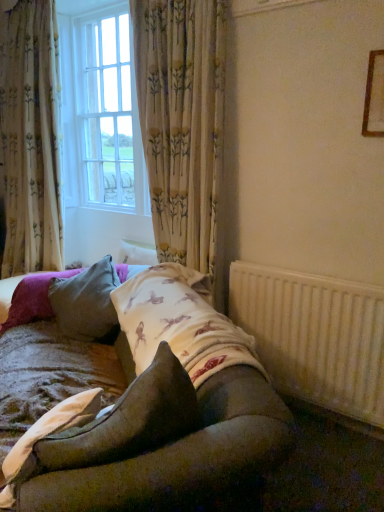
Question: From a real-world perspective, is white textured radiator at lower right positioned under wooden frame at upper right based on gravity?

Choices:
 (A) no
 (B) yes

Answer: (B)

Question: Can you confirm if white textured radiator at lower right is positioned to the left of wooden frame at upper right?

Choices:
 (A) yes
 (B) no

Answer: (A)

Question: Is white textured radiator at lower right beside wooden frame at upper right?

Choices:
 (A) yes
 (B) no

Answer: (B)

Question: Could you tell me if white textured radiator at lower right is turned towards wooden frame at upper right?

Choices:
 (A) no
 (B) yes

Answer: (A)

Question: Is the position of white textured radiator at lower right more distant than that of wooden frame at upper right?

Choices:
 (A) yes
 (B) no

Answer: (A)

Question: Looking at the image, does velvet brown pillow at center, the 2th pillow viewed from the back, seem bigger or smaller compared to white glass window at upper left?

Choices:
 (A) small
 (B) big

Answer: (A)

Question: Looking at their shapes, would you say velvet brown pillow at center, the 2th pillow viewed from the back, is wider or thinner than white glass window at upper left?

Choices:
 (A) wide
 (B) thin

Answer: (B)

Question: From the image's perspective, is velvet brown pillow at center, the 2th pillow viewed from the back, positioned above or below white glass window at upper left?

Choices:
 (A) above
 (B) below

Answer: (B)

Question: Do you think velvet brown pillow at center, arranged as the first pillow when viewed from the front, is within white glass window at upper left, or outside of it?

Choices:
 (A) inside
 (B) outside

Answer: (B)

Question: From the image's perspective, relative to velvet brown pillow at center, the 2th pillow viewed from the back, is floral fabric curtain at center, which is the second curtain in left-to-right order, above or below?

Choices:
 (A) above
 (B) below

Answer: (A)

Question: Is floral fabric curtain at center, which is the second curtain in left-to-right order, inside the boundaries of velvet brown pillow at center, arranged as the first pillow when viewed from the front, or outside?

Choices:
 (A) inside
 (B) outside

Answer: (B)

Question: From a real-world perspective, relative to velvet brown pillow at center, the 2th pillow viewed from the back, is floral fabric curtain at center, which is the second curtain in left-to-right order, vertically above or below?

Choices:
 (A) below
 (B) above

Answer: (B)

Question: Considering the positions of floral fabric curtain at center, arranged as the first curtain when viewed from the right, and velvet brown pillow at center, the 2th pillow viewed from the back, in the image, is floral fabric curtain at center, arranged as the first curtain when viewed from the right, taller or shorter than velvet brown pillow at center, the 2th pillow viewed from the back,?

Choices:
 (A) tall
 (B) short

Answer: (A)

Question: Would you say white textured radiator at lower right is to the left or to the right of textured beige quilt at lower left in the picture?

Choices:
 (A) left
 (B) right

Answer: (B)

Question: Would you say white textured radiator at lower right is inside or outside textured beige quilt at lower left?

Choices:
 (A) outside
 (B) inside

Answer: (A)